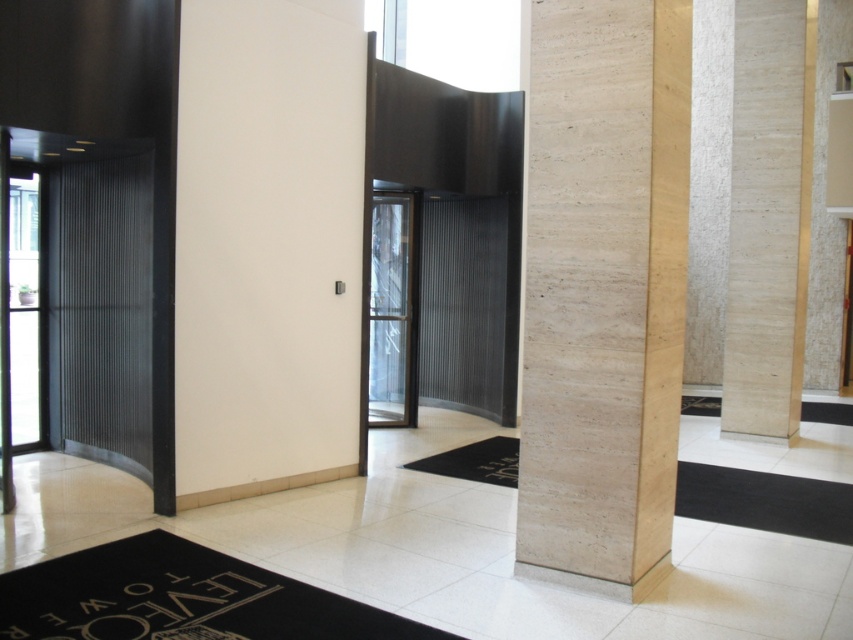
Between beige marble pillar at right and metallic ribbed elevator at left, which one is positioned lower?

Positioned lower is beige marble pillar at right.

Which is more to the right, beige marble pillar at right or metallic ribbed elevator at left?

beige marble pillar at right is more to the right.

Image resolution: width=853 pixels, height=640 pixels. Identify the location of beige marble pillar at right. (602, 291).

Is beige marble pillar at right positioned in front of transparent glass door at center?

That is True.

Is the position of beige marble pillar at right more distant than that of transparent glass door at center?

No, beige marble pillar at right is closer to the viewer.

Find the location of a particular element. Image resolution: width=853 pixels, height=640 pixels. beige marble pillar at right is located at coordinates (602, 291).

The image size is (853, 640). I want to click on metallic ribbed elevator at left, so click(x=91, y=296).

Is metallic ribbed elevator at left behind transparent glass door at center?

No, it is in front of transparent glass door at center.

Which is behind, point (86, 289) or point (405, 257)?

Positioned behind is point (405, 257).

Find the location of a particular element. This screenshot has height=640, width=853. metallic ribbed elevator at left is located at coordinates (91, 296).